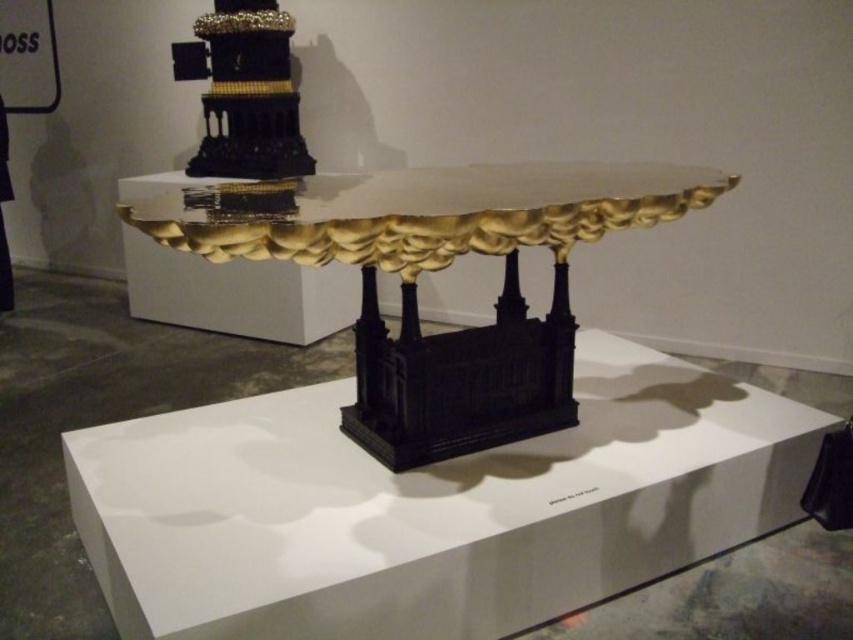
Does point (714, 492) lie behind point (508, 228)?

Yes, it is behind point (508, 228).

What do you see at coordinates (428, 508) in the screenshot? I see `black glossy table at center` at bounding box center [428, 508].

This screenshot has height=640, width=853. What are the coordinates of `black glossy table at center` in the screenshot? It's located at (428, 508).

Which is below, black glossy table at center or gold textured tower at upper center?

Positioned lower is black glossy table at center.

Can you confirm if black glossy table at center is positioned to the right of gold textured tower at upper center?

Indeed, black glossy table at center is positioned on the right side of gold textured tower at upper center.

Identify the location of black glossy table at center. (428, 508).

Can you confirm if gold glossy table at center is taller than gold textured tower at upper center?

Indeed, gold glossy table at center has a greater height compared to gold textured tower at upper center.

Does gold glossy table at center appear under gold textured tower at upper center?

Yes.

What are the coordinates of `gold glossy table at center` in the screenshot? It's located at (437, 269).